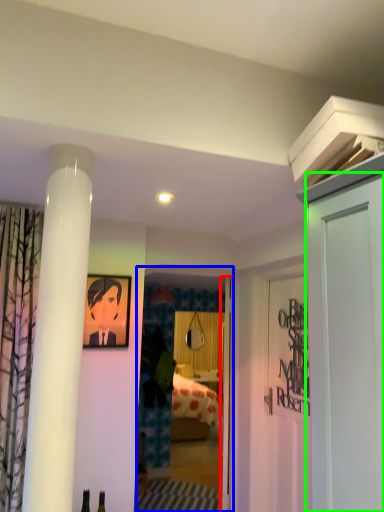
Question: Which object is the farthest from door (highlighted by a red box)? Choose among these: glass door (highlighted by a blue box) or door (highlighted by a green box).

Choices:
 (A) glass door
 (B) door

Answer: (B)